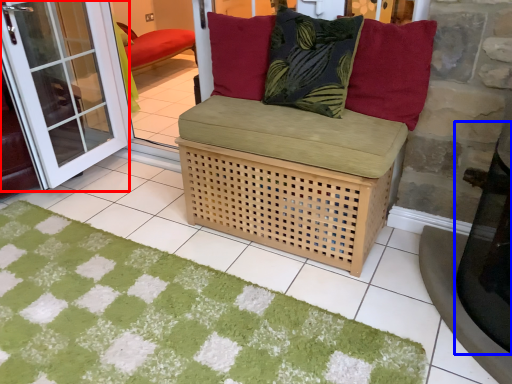
Question: Among these objects, which one is nearest to the camera, screen door (highlighted by a red box) or table (highlighted by a blue box)?

Choices:
 (A) screen door
 (B) table

Answer: (B)